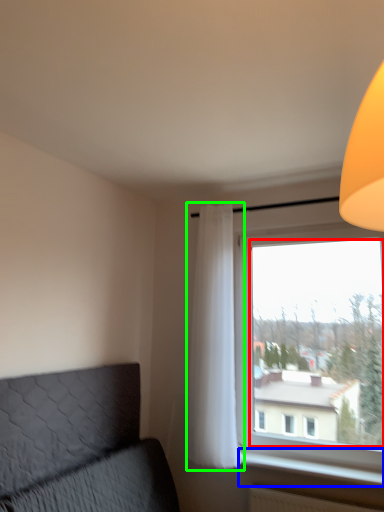
Question: Based on their relative distances, which object is nearer to window screen (highlighted by a red box)? Choose from window sill (highlighted by a blue box) and curtain (highlighted by a green box).

Choices:
 (A) window sill
 (B) curtain

Answer: (B)